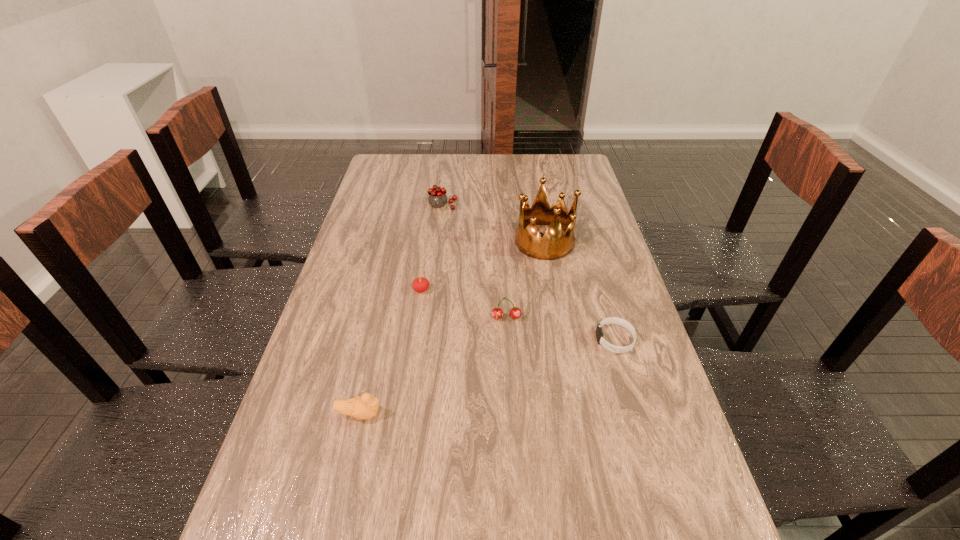
Where is `vacant space that satisfies the following two spatial constraints: 1. with stems pointing upwards on the fourth object from left to right; 2. on the face of the nearest object`? The height and width of the screenshot is (540, 960). vacant space that satisfies the following two spatial constraints: 1. with stems pointing upwards on the fourth object from left to right; 2. on the face of the nearest object is located at coordinates (512, 414).

Where is `free space that satisfies the following two spatial constraints: 1. on the handle side of the fifth shortest object; 2. on the face of the duckling`? The height and width of the screenshot is (540, 960). free space that satisfies the following two spatial constraints: 1. on the handle side of the fifth shortest object; 2. on the face of the duckling is located at coordinates (419, 414).